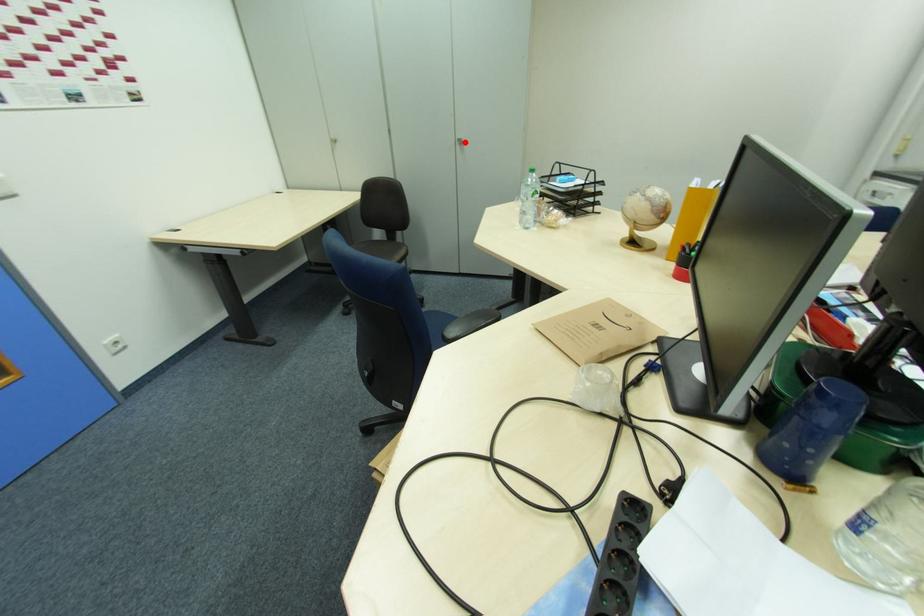
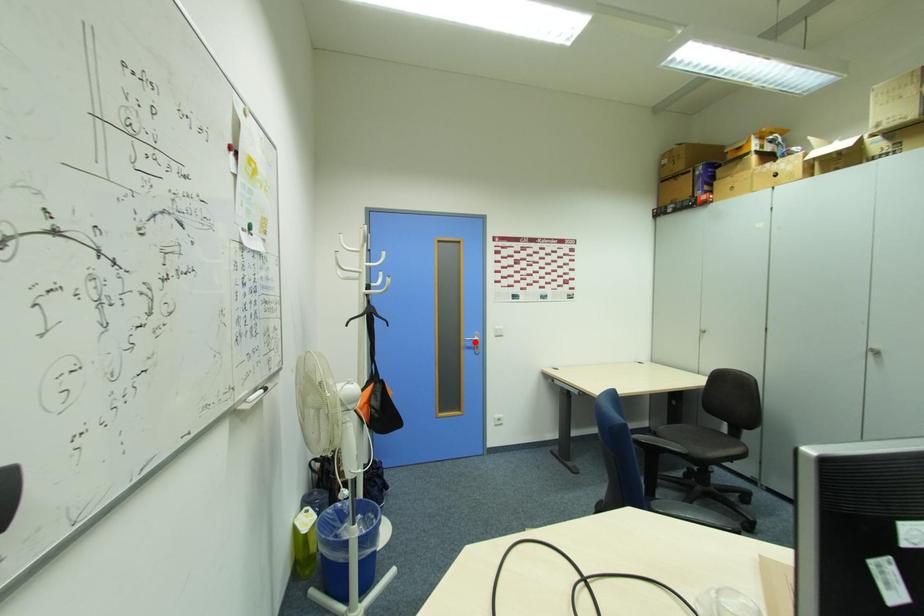
I am providing you with two images of the same scene from different viewpoints. A red point is marked on the first image and another point is marked on the second image. Do the highlighted points in image1 and image2 indicate the same real-world spot?

No